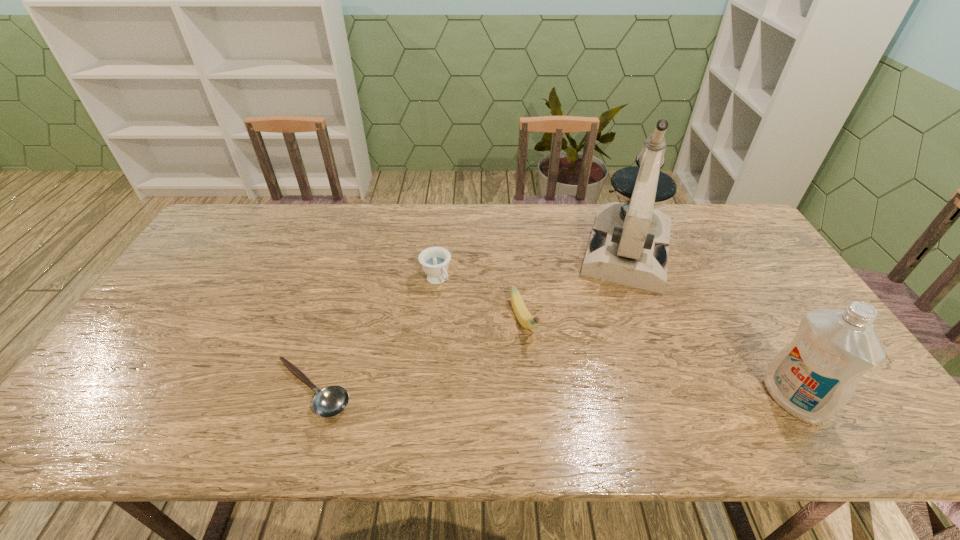
Image resolution: width=960 pixels, height=540 pixels. I want to click on empty space that is in between the third object from left to right and the ladle, so coord(418,355).

Identify the location of empty space that is in between the fourth shortest object and the ladle. (552, 394).

Identify the location of vacant space that's between the shortest object and the detergent. This screenshot has width=960, height=540. (552, 394).

You are a GUI agent. You are given a task and a screenshot of the screen. Output one action in this format:
    pyautogui.click(x=<x>, y=<y>)
    Task: Click on the unoccupied position between the teacup and the third object from right to left
    
    Given the screenshot: What is the action you would take?
    pyautogui.click(x=480, y=301)

Where is `free space between the teacup and the shortest object`? The height and width of the screenshot is (540, 960). free space between the teacup and the shortest object is located at coordinates (374, 335).

At what (x,y) coordinates should I click in order to perform the action: click on vacant space in between the detergent and the ladle. Please return your answer as a coordinate pair (x, y). The height and width of the screenshot is (540, 960). Looking at the image, I should click on 552,394.

This screenshot has width=960, height=540. What are the coordinates of `vacant space that is in between the banana and the leftmost object` in the screenshot? It's located at (418, 355).

Locate an element on the screen. vacant area that lies between the tallest object and the leftmost object is located at coordinates click(x=469, y=320).

The width and height of the screenshot is (960, 540). In order to click on the closest object to the fourth object from left to right in this screenshot , I will do click(x=524, y=317).

Find the location of a particular element. The height and width of the screenshot is (540, 960). object that is the fourth closest to the leftmost object is located at coordinates (813, 378).